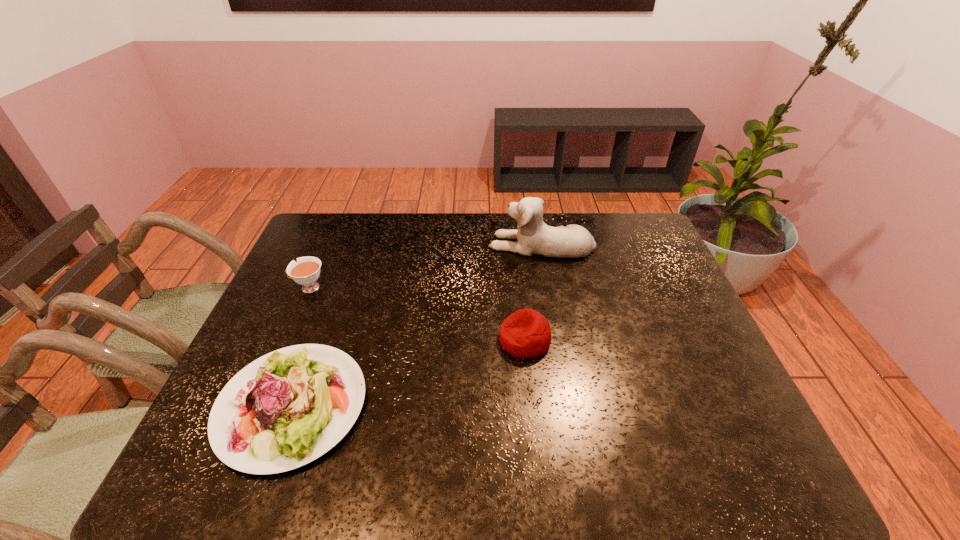
The image size is (960, 540). I want to click on free space between the second farthest object and the puppy, so click(x=425, y=266).

You are a GUI agent. You are given a task and a screenshot of the screen. Output one action in this format:
    pyautogui.click(x=<x>, y=<y>)
    Task: Click on the vacant area that lies between the teacup and the beanbag
    
    Given the screenshot: What is the action you would take?
    pyautogui.click(x=417, y=314)

Identify the location of object that is the third closest one to the beanbag. tap(306, 271).

In order to click on object that can be found as the closest to the beanbag in this screenshot , I will do `click(534, 236)`.

The height and width of the screenshot is (540, 960). Find the location of `blank area in the image that satisfies the following two spatial constraints: 1. on the side of the teacup with the handle; 2. on the left side of the salad plate`. blank area in the image that satisfies the following two spatial constraints: 1. on the side of the teacup with the handle; 2. on the left side of the salad plate is located at coordinates (257, 406).

Find the location of a particular element. The height and width of the screenshot is (540, 960). vacant position in the image that satisfies the following two spatial constraints: 1. on the side of the second farthest object with the handle; 2. on the right side of the salad plate is located at coordinates (257, 406).

Locate an element on the screen. The width and height of the screenshot is (960, 540). vacant position in the image that satisfies the following two spatial constraints: 1. on the side of the salad plate with the handle; 2. on the left side of the second farthest object is located at coordinates (257, 406).